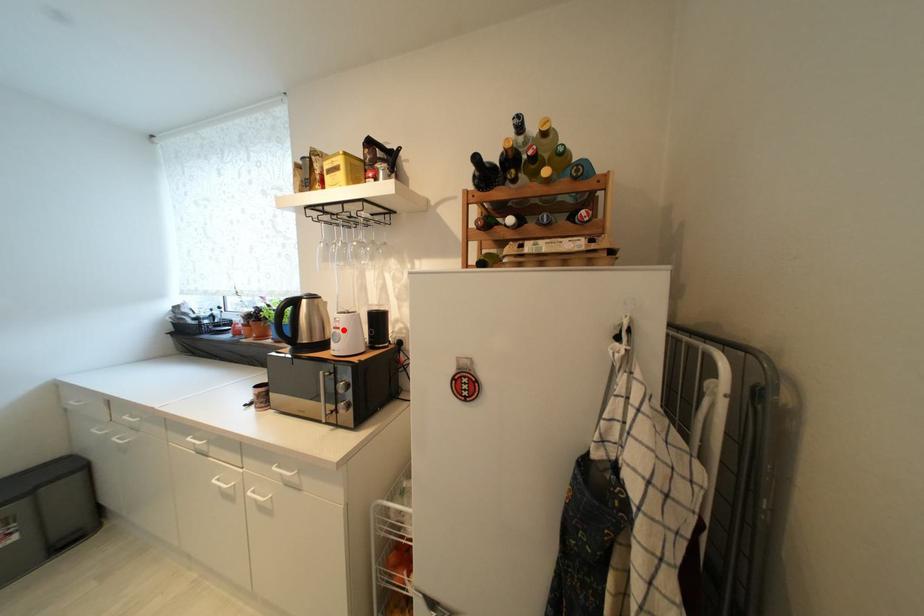
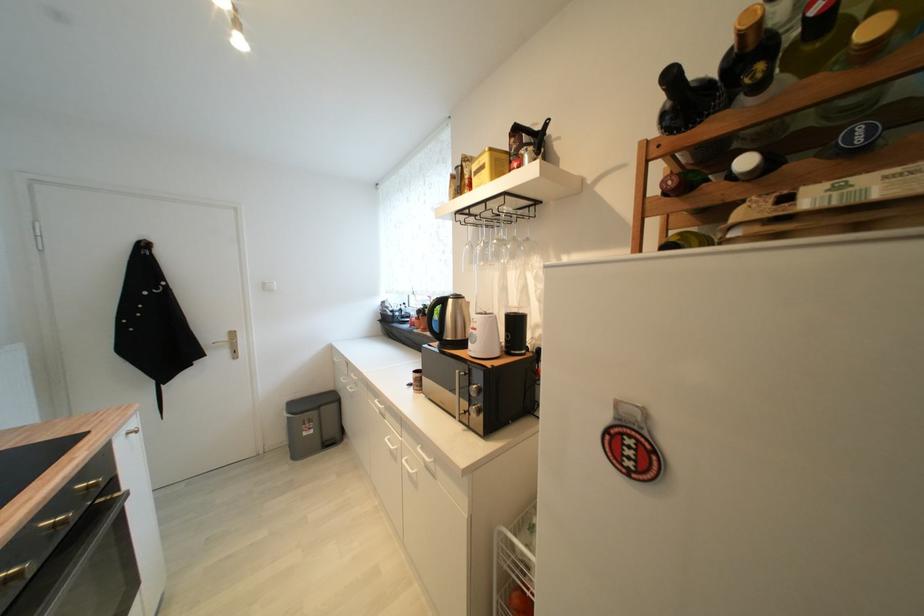
Question: I am providing you with two images of the same scene from different viewpoints. A red point is marked on the first image. Is the red point's position out of view in image 2?

Choices:
 (A) Yes
 (B) No

Answer: (B)